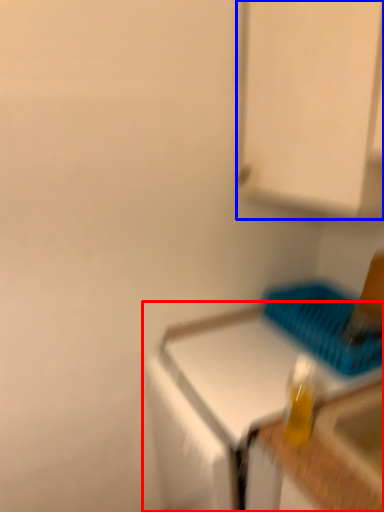
Question: Among these objects, which one is nearest to the camera, countertop (highlighted by a red box) or cabinetry (highlighted by a blue box)?

Choices:
 (A) countertop
 (B) cabinetry

Answer: (B)